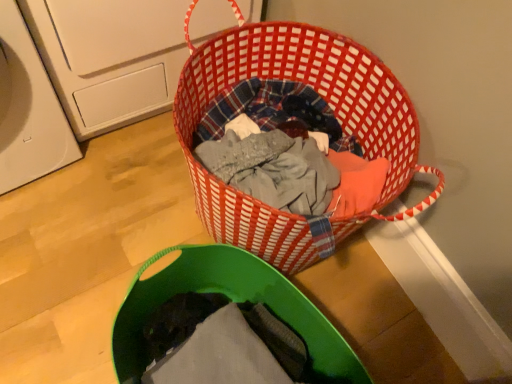
At what (x,y) coordinates should I click in order to perform the action: click on free space to the left of red woven basket at center. Please return your answer as a coordinate pair (x, y). Looking at the image, I should click on (123, 205).